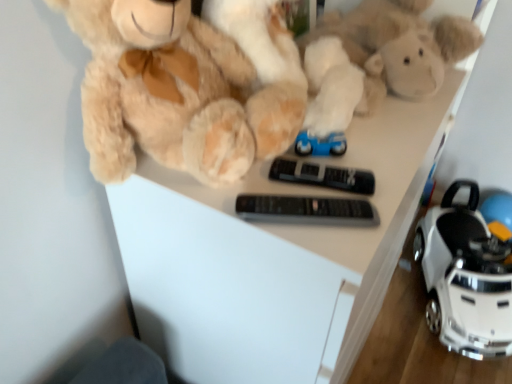
Question: From a real-world perspective, does white plastic toy car at lower right stand above black plastic remote at center, the first control in the back-to-front sequence?

Choices:
 (A) yes
 (B) no

Answer: (B)

Question: From a real-world perspective, is white plastic toy car at lower right positioned under black plastic remote at center, the first control in the back-to-front sequence, based on gravity?

Choices:
 (A) yes
 (B) no

Answer: (A)

Question: Is the depth of white plastic toy car at lower right greater than that of black plastic remote at center, acting as the second control starting from the front?

Choices:
 (A) no
 (B) yes

Answer: (B)

Question: From the image's perspective, is white plastic toy car at lower right on top of black plastic remote at center, acting as the second control starting from the front?

Choices:
 (A) no
 (B) yes

Answer: (A)

Question: Considering the relative positions of white plastic toy car at lower right and black plastic remote at center, the first control in the back-to-front sequence, in the image provided, is white plastic toy car at lower right in front of black plastic remote at center, the first control in the back-to-front sequence,?

Choices:
 (A) yes
 (B) no

Answer: (B)

Question: Is white plastic toy car at lower right positioned beyond the bounds of black plastic remote at center, the first control in the back-to-front sequence?

Choices:
 (A) no
 (B) yes

Answer: (B)

Question: Can you confirm if fluffy beige teddy bear at upper left is smaller than black plastic remote at center, placed as the second control when sorted from back to front?

Choices:
 (A) yes
 (B) no

Answer: (B)

Question: Does fluffy beige teddy bear at upper left have a greater width compared to black plastic remote at center, placed as the second control when sorted from back to front?

Choices:
 (A) no
 (B) yes

Answer: (B)

Question: Is fluffy beige teddy bear at upper left facing away from black plastic remote at center, which is the 1th control from front to back?

Choices:
 (A) no
 (B) yes

Answer: (A)

Question: Can you confirm if fluffy beige teddy bear at upper left is bigger than black plastic remote at center, placed as the second control when sorted from back to front?

Choices:
 (A) no
 (B) yes

Answer: (B)

Question: Considering the relative sizes of fluffy beige teddy bear at upper left and black plastic remote at center, which is the 1th control from front to back, in the image provided, is fluffy beige teddy bear at upper left thinner than black plastic remote at center, which is the 1th control from front to back,?

Choices:
 (A) no
 (B) yes

Answer: (A)

Question: From the image's perspective, is fluffy beige teddy bear at upper left above black plastic remote at center, which is the 1th control from front to back?

Choices:
 (A) yes
 (B) no

Answer: (A)

Question: Is black plastic remote at center, acting as the second control starting from the front, next to white plastic toy car at lower right?

Choices:
 (A) yes
 (B) no

Answer: (B)